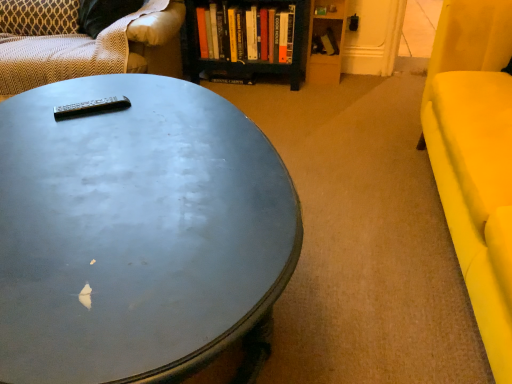
Identify the location of spots to the right of metallic gray coffee table at center. (362, 232).